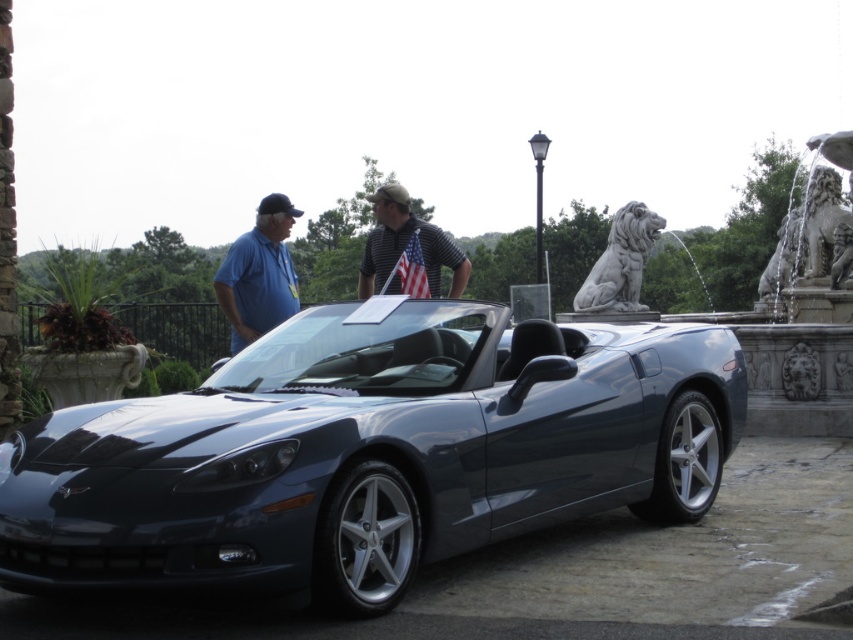
Does blue cotton shirt at left have a larger size compared to gray stone lion at upper right?

No.

I want to click on blue cotton shirt at left, so click(259, 275).

Can you confirm if blue cotton shirt at left is taller than striped polo shirt at center?

Incorrect, blue cotton shirt at left's height is not larger of striped polo shirt at center's.

Can you confirm if blue cotton shirt at left is smaller than striped polo shirt at center?

Indeed, blue cotton shirt at left has a smaller size compared to striped polo shirt at center.

Which is in front, point (251, 256) or point (425, 227)?

Point (251, 256) is in front.

This screenshot has height=640, width=853. What are the coordinates of `blue cotton shirt at left` in the screenshot? It's located at (259, 275).

Based on the photo, is white stone lion at right thinner than striped polo shirt at center?

Correct, white stone lion at right's width is less than striped polo shirt at center's.

Between white stone lion at right and striped polo shirt at center, which one appears on the left side from the viewer's perspective?

Positioned to the left is striped polo shirt at center.

Is point (776, 275) positioned in front of point (375, 289)?

No.

This screenshot has height=640, width=853. Identify the location of white stone lion at right. (815, 243).